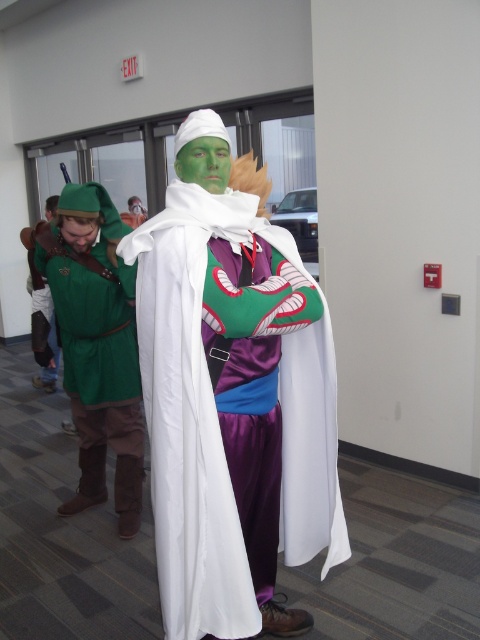
Is satin green cape at center taller than green matte tunic at left?

Correct, satin green cape at center is much taller as green matte tunic at left.

Does satin green cape at center lie in front of green matte tunic at left?

That is True.

Does point (326, 374) lie behind point (116, 326)?

No.

This screenshot has height=640, width=480. Identify the location of satin green cape at center. (232, 397).